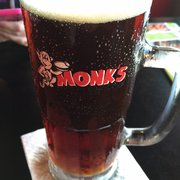
This screenshot has width=180, height=180. Find the location of `handle`. handle is located at coordinates (162, 128).